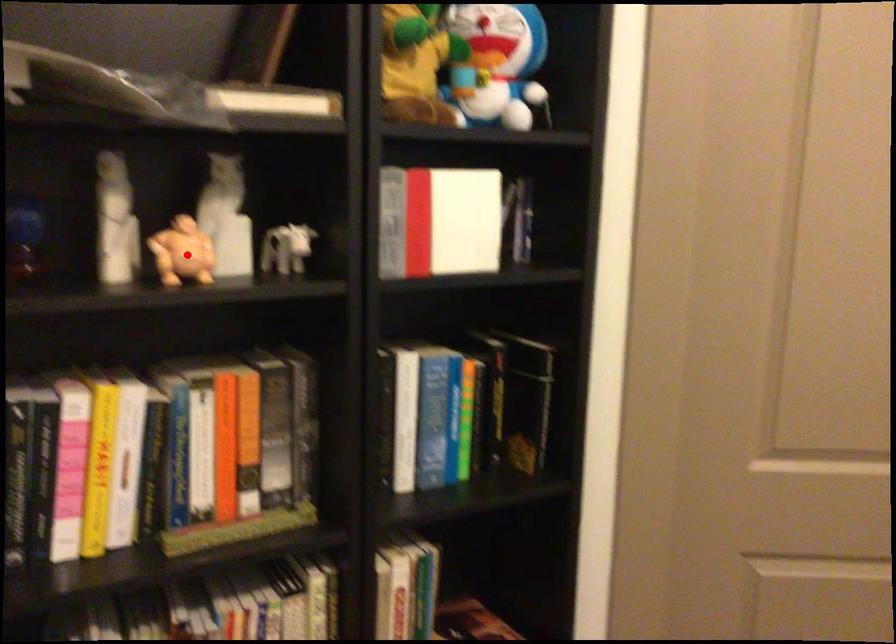
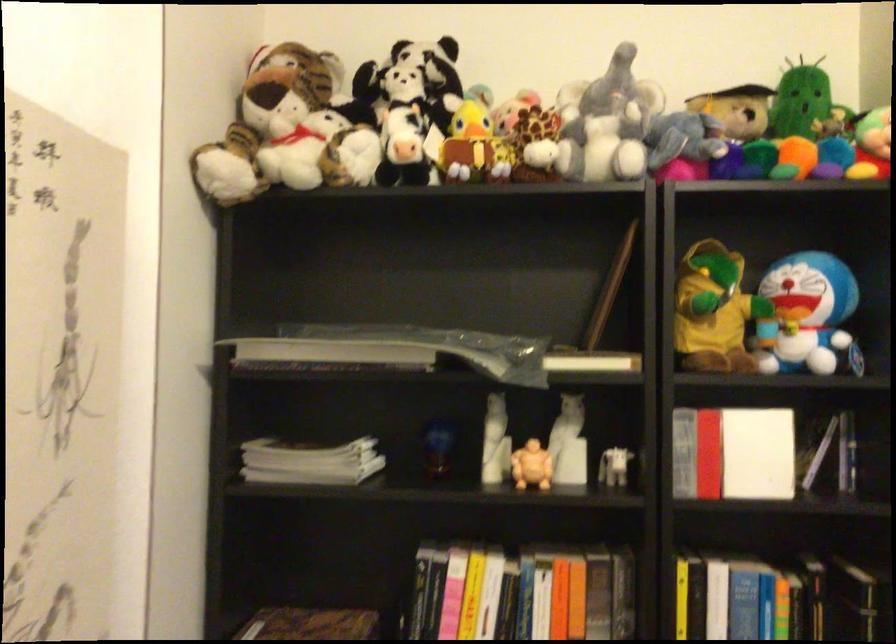
The point at the highlighted location is marked in the first image. Where is the corresponding point in the second image?

(531, 466)